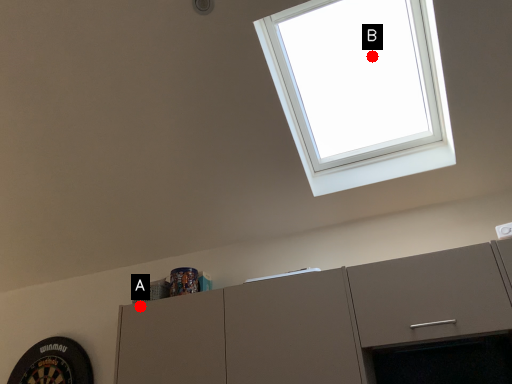
Question: Two points are circled on the image, labeled by A and B beside each circle. Which point is farther to the camera?

Choices:
 (A) A is further
 (B) B is further

Answer: (B)